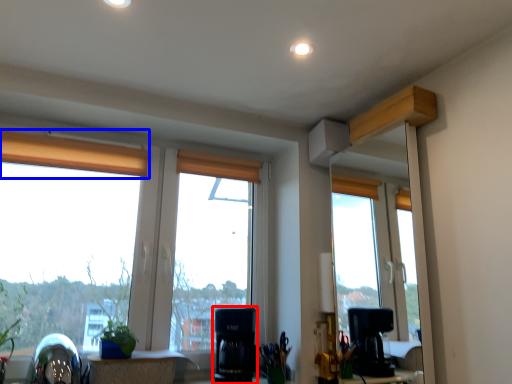
Question: Which object is closer to the camera taking this photo, appliance (highlighted by a red box) or curtain (highlighted by a blue box)?

Choices:
 (A) appliance
 (B) curtain

Answer: (A)